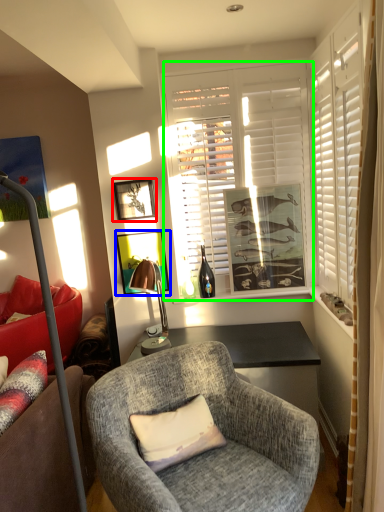
Question: Estimate the real-world distances between objects in this image. Which object is closer to picture frame (highlighted by a red box), picture frame (highlighted by a blue box) or window (highlighted by a green box)?

Choices:
 (A) picture frame
 (B) window

Answer: (A)